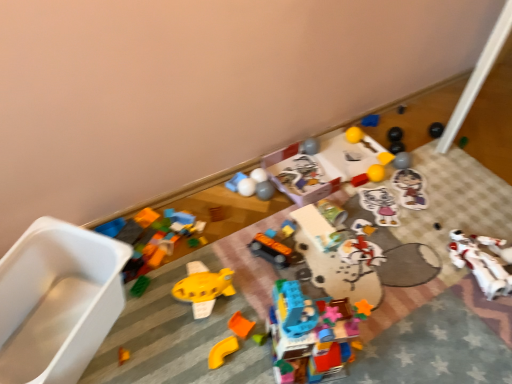
Question: Which direction should I rotate to look at yellow rubber ball at upper center, the 3th toy in the right-to-left sequence?

Choices:
 (A) right
 (B) left

Answer: (A)

Question: Is metallic silver can at center, marked as the 10th toy in a left-to-right arrangement, surrounded by matte gray ball at center, which is the 7th toy in left-to-right order?

Choices:
 (A) yes
 (B) no

Answer: (B)

Question: From the image's perspective, is matte gray ball at center, which is the 7th toy in left-to-right order, on metallic silver can at center, marked as the 10th toy in a left-to-right arrangement?

Choices:
 (A) no
 (B) yes

Answer: (B)

Question: Does matte gray ball at center, which is the 7th toy in left-to-right order, lie in front of metallic silver can at center, arranged as the 8th toy when viewed from the right?

Choices:
 (A) yes
 (B) no

Answer: (B)

Question: Does matte gray ball at center, which is the 7th toy in left-to-right order, have a greater width compared to metallic silver can at center, arranged as the 8th toy when viewed from the right?

Choices:
 (A) yes
 (B) no

Answer: (B)

Question: Is matte gray ball at center, which is the 7th toy in left-to-right order, located outside metallic silver can at center, marked as the 10th toy in a left-to-right arrangement?

Choices:
 (A) no
 (B) yes

Answer: (B)

Question: Is matte gray ball at center, which is the 7th toy in left-to-right order, turned away from metallic silver can at center, arranged as the 8th toy when viewed from the right?

Choices:
 (A) no
 (B) yes

Answer: (A)

Question: From the image's perspective, would you say white plastic robot at lower right, the first toy positioned from the right, is shown under blue matte block at upper center, positioned as the 4th toy in right-to-left order?

Choices:
 (A) no
 (B) yes

Answer: (B)

Question: Does white plastic robot at lower right, which appears as the seventeenth toy when viewed from the left, come behind blue matte block at upper center, positioned as the 4th toy in right-to-left order?

Choices:
 (A) no
 (B) yes

Answer: (A)

Question: Is blue matte block at upper center, positioned as the 4th toy in right-to-left order, at the back of white plastic robot at lower right, the first toy positioned from the right?

Choices:
 (A) no
 (B) yes

Answer: (B)

Question: Is white plastic robot at lower right, the first toy positioned from the right, at the left side of blue matte block at upper center, positioned as the 4th toy in right-to-left order?

Choices:
 (A) yes
 (B) no

Answer: (B)

Question: Could you tell me if white plastic robot at lower right, the first toy positioned from the right, is facing blue matte block at upper center, positioned as the 4th toy in right-to-left order?

Choices:
 (A) yes
 (B) no

Answer: (B)

Question: From the image's perspective, would you say white plastic robot at lower right, the first toy positioned from the right, is positioned over blue matte block at upper center, positioned as the 4th toy in right-to-left order?

Choices:
 (A) no
 (B) yes

Answer: (A)

Question: Is yellow rubber ball at upper center, which appears as the 6th toy when viewed from the right, taller than translucent plastic building blocks at center, which ranks as the ninth toy in right-to-left order?

Choices:
 (A) yes
 (B) no

Answer: (B)